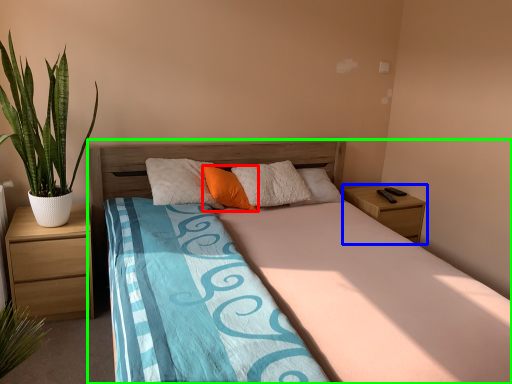
Question: Which object is positioned closest to pillow (highlighted by a red box)? Select from nightstand (highlighted by a blue box) and bed (highlighted by a green box).

Choices:
 (A) nightstand
 (B) bed

Answer: (B)